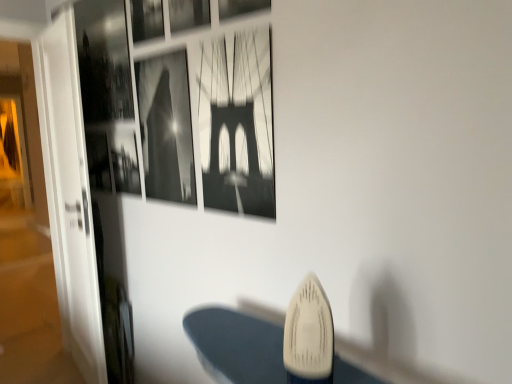
Question: From the image's perspective, is metallic silver picture frame at upper center, which appears as the 1th picture frame when viewed from the right, over transparent glass door at left?

Choices:
 (A) yes
 (B) no

Answer: (A)

Question: From a real-world perspective, is metallic silver picture frame at upper center, which appears as the 1th picture frame when viewed from the right, physically below transparent glass door at left?

Choices:
 (A) no
 (B) yes

Answer: (A)

Question: Is metallic silver picture frame at upper center, which appears as the 1th picture frame when viewed from the right, wider than transparent glass door at left?

Choices:
 (A) no
 (B) yes

Answer: (A)

Question: Could you tell me if metallic silver picture frame at upper center, the 5th picture frame viewed from the left, is facing transparent glass door at left?

Choices:
 (A) no
 (B) yes

Answer: (A)

Question: Is metallic silver picture frame at upper center, the 5th picture frame viewed from the left, shorter than transparent glass door at left?

Choices:
 (A) yes
 (B) no

Answer: (A)

Question: Is metallic silver picture frame at upper center, which appears as the 1th picture frame when viewed from the right, turned away from transparent glass door at left?

Choices:
 (A) no
 (B) yes

Answer: (A)

Question: From a real-world perspective, is metallic silver picture frame at upper center, which ranks as the third picture frame in left-to-right order, under transparent glass door at left?

Choices:
 (A) no
 (B) yes

Answer: (A)

Question: Does metallic silver picture frame at upper center, which ranks as the third picture frame in left-to-right order, have a larger size compared to transparent glass door at left?

Choices:
 (A) no
 (B) yes

Answer: (A)

Question: Does metallic silver picture frame at upper center, the 3th picture frame when ordered from right to left, turn towards transparent glass door at left?

Choices:
 (A) no
 (B) yes

Answer: (A)

Question: Can you see metallic silver picture frame at upper center, the 3th picture frame when ordered from right to left, touching transparent glass door at left?

Choices:
 (A) no
 (B) yes

Answer: (A)

Question: Does metallic silver picture frame at upper center, which ranks as the third picture frame in left-to-right order, have a smaller size compared to transparent glass door at left?

Choices:
 (A) yes
 (B) no

Answer: (A)

Question: From the image's perspective, would you say metallic silver picture frame at upper center, the 3th picture frame when ordered from right to left, is shown under transparent glass door at left?

Choices:
 (A) no
 (B) yes

Answer: (A)

Question: From the image's perspective, is black paper at center, marked as the fourth picture frame in a left-to-right arrangement, located above metallic silver picture frame at upper center, which ranks as the third picture frame in left-to-right order?

Choices:
 (A) no
 (B) yes

Answer: (A)